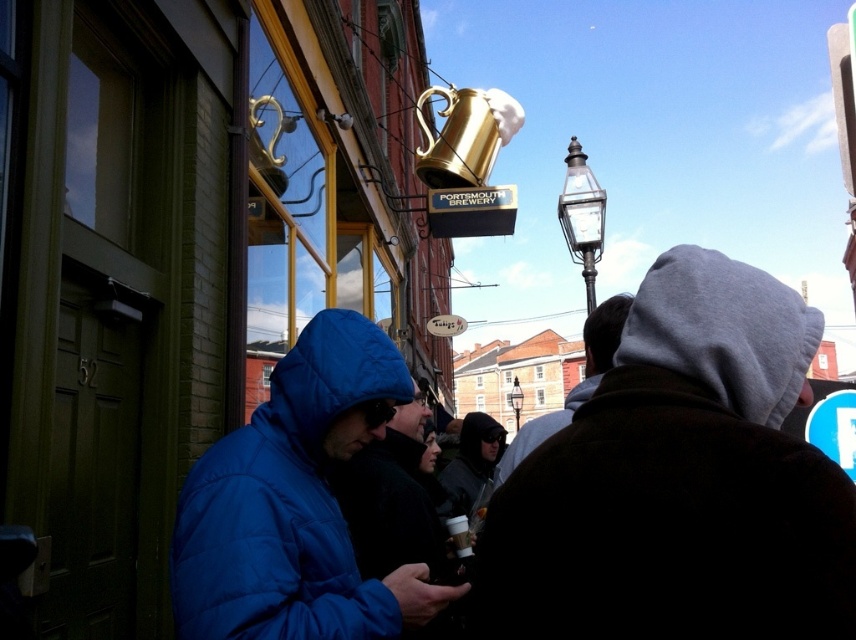
Between blue puffy jacket at center and polished brass lamp post at center, which one has less height?

blue puffy jacket at center

This screenshot has width=856, height=640. Identify the location of blue puffy jacket at center. (393, 500).

Is gray fleece jacket at upper right to the right of clear glass lamp post at upper right from the viewer's perspective?

In fact, gray fleece jacket at upper right is to the left of clear glass lamp post at upper right.

In order to click on gray fleece jacket at upper right in this screenshot , I will do `click(574, 385)`.

The image size is (856, 640). Identify the location of gray fleece jacket at upper right. [574, 385].

Looking at this image, is clear glass lamp post at upper right bigger than polished brass lamp post at center?

No.

Is clear glass lamp post at upper right wider than polished brass lamp post at center?

No.

Describe the element at coordinates (581, 216) in the screenshot. This screenshot has height=640, width=856. I see `clear glass lamp post at upper right` at that location.

In order to click on clear glass lamp post at upper right in this screenshot , I will do `click(581, 216)`.